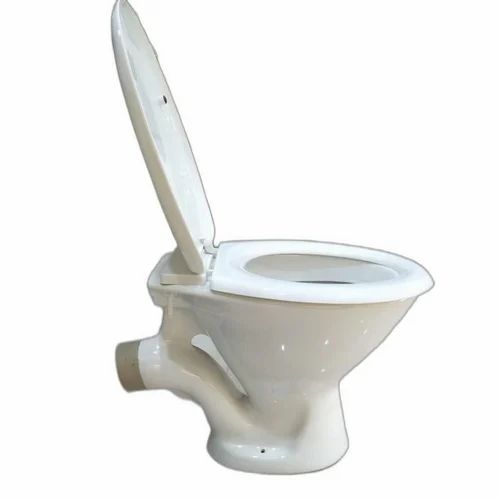
Image resolution: width=500 pixels, height=500 pixels. I want to click on empty space above toilet, so 313,140.